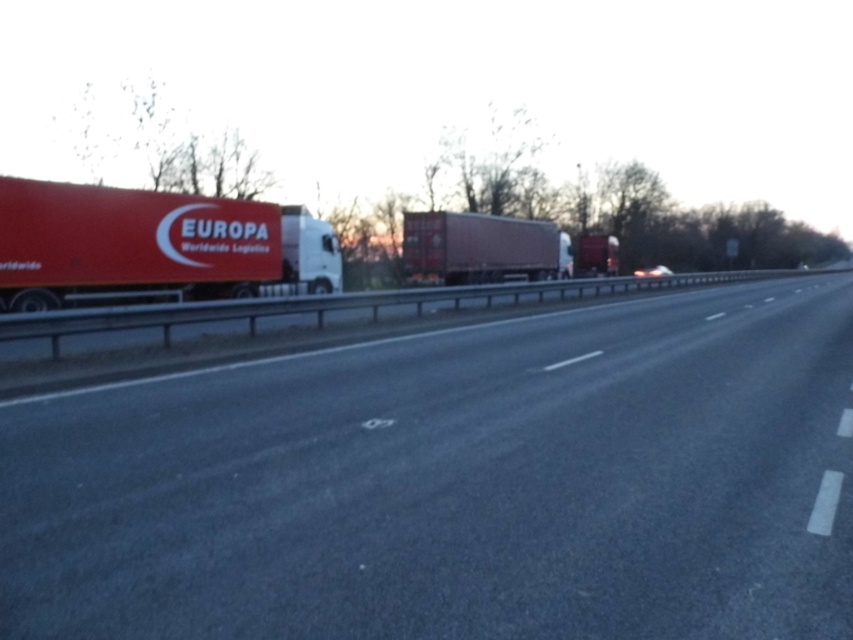
Is point (753, 404) positioned behind point (192, 252)?

No, it is not.

Does smooth asphalt highway at center have a larger size compared to matte red truck at left?

No, smooth asphalt highway at center is not bigger than matte red truck at left.

Is point (490, 484) farther from viewer compared to point (152, 230)?

That is False.

The image size is (853, 640). I want to click on smooth asphalt highway at center, so click(x=456, y=483).

Does matte red truck at left come in front of matte red trailer truck at center?

That is True.

Is matte red truck at left thinner than matte red trailer truck at center?

Yes.

Between point (334, 232) and point (506, 224), which one is positioned behind?

Point (506, 224)

The width and height of the screenshot is (853, 640). Find the location of `matte red truck at left`. matte red truck at left is located at coordinates (151, 244).

Which is above, smooth asphalt highway at center or matte red trailer truck at center?

matte red trailer truck at center

Who is shorter, smooth asphalt highway at center or matte red trailer truck at center?

smooth asphalt highway at center is shorter.

Is point (503, 570) more distant than point (503, 252)?

No.

Locate an element on the screen. This screenshot has width=853, height=640. smooth asphalt highway at center is located at coordinates (456, 483).